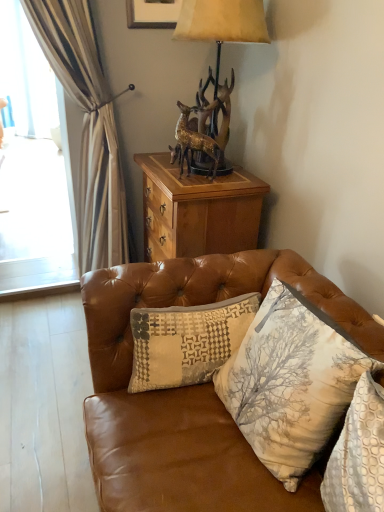
Question: Is wooden cabinet at upper center completely or partially outside of printed fabric cushion at lower right, positioned as the 1th pillow in right-to-left order?

Choices:
 (A) no
 (B) yes

Answer: (B)

Question: Is there a large distance between wooden cabinet at upper center and printed fabric cushion at lower right, arranged as the 3th pillow when viewed from the left?

Choices:
 (A) yes
 (B) no

Answer: (A)

Question: Can you confirm if wooden cabinet at upper center is positioned to the left of printed fabric cushion at lower right, arranged as the 3th pillow when viewed from the left?

Choices:
 (A) yes
 (B) no

Answer: (A)

Question: From the image's perspective, is wooden cabinet at upper center below printed fabric cushion at lower right, positioned as the 1th pillow in right-to-left order?

Choices:
 (A) yes
 (B) no

Answer: (B)

Question: From a real-world perspective, is wooden cabinet at upper center over printed fabric cushion at lower right, arranged as the 3th pillow when viewed from the left?

Choices:
 (A) yes
 (B) no

Answer: (B)

Question: Is wooden cabinet at upper center placed right next to printed fabric cushion at lower right, arranged as the 3th pillow when viewed from the left?

Choices:
 (A) no
 (B) yes

Answer: (A)

Question: Is textured beige pillow at center, which ranks as the 1th pillow in left-to-right order, thinner than wooden cabinet at upper center?

Choices:
 (A) yes
 (B) no

Answer: (A)

Question: Considering the relative positions of textured beige pillow at center, which ranks as the 1th pillow in left-to-right order, and wooden cabinet at upper center in the image provided, is textured beige pillow at center, which ranks as the 1th pillow in left-to-right order, to the right of wooden cabinet at upper center from the viewer's perspective?

Choices:
 (A) yes
 (B) no

Answer: (B)

Question: Does textured beige pillow at center, which ranks as the 1th pillow in left-to-right order, have a smaller size compared to wooden cabinet at upper center?

Choices:
 (A) no
 (B) yes

Answer: (B)

Question: Is textured beige pillow at center, which is the 3th pillow from right to left, wider than wooden cabinet at upper center?

Choices:
 (A) no
 (B) yes

Answer: (A)

Question: Does textured beige pillow at center, which is the 3th pillow from right to left, have a greater height compared to wooden cabinet at upper center?

Choices:
 (A) yes
 (B) no

Answer: (B)

Question: From a real-world perspective, is textured beige pillow at center, which is the 3th pillow from right to left, physically above wooden cabinet at upper center?

Choices:
 (A) yes
 (B) no

Answer: (B)

Question: From a real-world perspective, is textured beige pillow at center, which is the 3th pillow from right to left, located higher than matte gray picture frame at upper center?

Choices:
 (A) yes
 (B) no

Answer: (B)